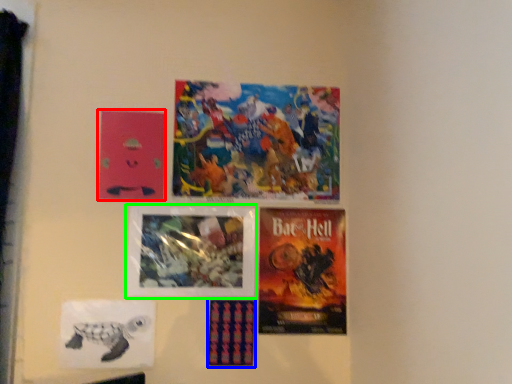
Question: Based on their relative distances, which object is nearer to poster (highlighted by a red box)? Choose from poster (highlighted by a blue box) and poster (highlighted by a green box).

Choices:
 (A) poster
 (B) poster

Answer: (B)